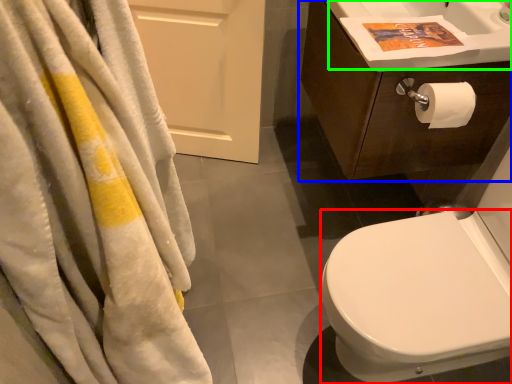
Question: Based on their relative distances, which object is nearer to bidet (highlighted by a red box)? Choose from bathroom cabinet (highlighted by a blue box) and sink (highlighted by a green box).

Choices:
 (A) bathroom cabinet
 (B) sink

Answer: (A)